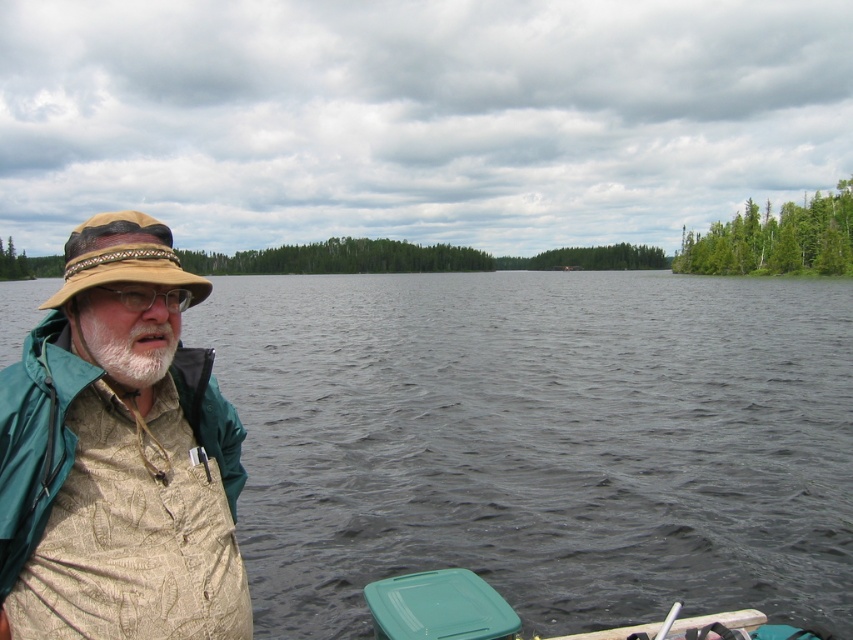
Question: Can you confirm if khaki fabric hat at left is positioned to the left of whitewoollybeard at left?

Choices:
 (A) no
 (B) yes

Answer: (B)

Question: Which is farther from the khaki fabric hat at left?

Choices:
 (A) dark gray water at center
 (B) tan woven hat at left
 (C) whitewoollybeard at left

Answer: (A)

Question: Can you confirm if tan woven hat at left is positioned to the left of whitewoollybeard at left?

Choices:
 (A) yes
 (B) no

Answer: (A)

Question: Is green plastic cooler at lower center thinner than tan woven hat at left?

Choices:
 (A) yes
 (B) no

Answer: (A)

Question: Which object appears closest to the camera in this image?

Choices:
 (A) dark gray water at center
 (B) green plastic cooler at lower center

Answer: (B)

Question: Based on their relative distances, which object is farther from the dark gray water at center?

Choices:
 (A) green plastic cooler at lower center
 (B) tan woven hat at left
 (C) whitewoollybeard at left

Answer: (B)